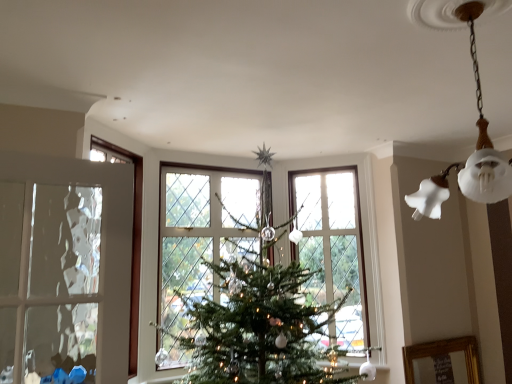
What do you see at coordinates (333, 248) in the screenshot? The height and width of the screenshot is (384, 512). I see `clear glass window at center` at bounding box center [333, 248].

Measure the distance between point (328,285) and camera.

3.58 meters.

The height and width of the screenshot is (384, 512). In order to click on clear glass window at center in this screenshot , I will do `click(333, 248)`.

Describe the element at coordinates (476, 122) in the screenshot. I see `white frosted glass bell at upper right` at that location.

Identify the location of white frosted glass bell at upper right. (476, 122).

Find the location of a particular element. The width and height of the screenshot is (512, 384). clear glass window at center is located at coordinates (333, 248).

Is white frosted glass bell at upper right at the left side of clear glass window at center?

Incorrect, white frosted glass bell at upper right is not on the left side of clear glass window at center.

Is white frosted glass bell at upper right further to camera compared to clear glass window at center?

No.

Is point (449, 15) positioned before point (364, 308)?

Yes, point (449, 15) is closer to viewer.

From the image's perspective, between white frosted glass bell at upper right and clear glass window at center, who is located below?

clear glass window at center.

From a real-world perspective, is white frosted glass bell at upper right physically above clear glass window at center?

Yes, from a real-world perspective, white frosted glass bell at upper right is above clear glass window at center.

Is white frosted glass bell at upper right wider than clear glass window at center?

Yes.

Does white frosted glass bell at upper right have a lesser height compared to clear glass window at center?

Indeed, white frosted glass bell at upper right has a lesser height compared to clear glass window at center.

Considering the sizes of white frosted glass bell at upper right and clear glass window at center in the image, is white frosted glass bell at upper right bigger or smaller than clear glass window at center?

white frosted glass bell at upper right is bigger than clear glass window at center.

Choose the correct answer: Is white frosted glass bell at upper right inside clear glass window at center or outside it?

white frosted glass bell at upper right is not inside clear glass window at center, it's outside.

Is white frosted glass bell at upper right directly adjacent to clear glass window at center?

No, white frosted glass bell at upper right is not with clear glass window at center.

Is white frosted glass bell at upper right looking in the opposite direction of clear glass window at center?

No, white frosted glass bell at upper right's orientation is not away from clear glass window at center.

At what (x,y) coordinates should I click in order to perform the action: click on window lying below the white frosted glass bell at upper right (from the image's perspective). Please return your answer as a coordinate pair (x, y). This screenshot has height=384, width=512. Looking at the image, I should click on (333, 248).

Considering the positions of objects clear glass window at center and white frosted glass bell at upper right in the image provided, who is more to the left, clear glass window at center or white frosted glass bell at upper right?

clear glass window at center is more to the left.

Consider the image. Is clear glass window at center in front of or behind white frosted glass bell at upper right in the image?

Visually, clear glass window at center is located behind white frosted glass bell at upper right.

Is point (311, 258) farther from viewer compared to point (496, 191)?

Yes, point (311, 258) is farther from viewer.

From the image's perspective, which is above, clear glass window at center or white frosted glass bell at upper right?

white frosted glass bell at upper right is shown above in the image.

From a real-world perspective, is clear glass window at center under white frosted glass bell at upper right?

Yes, from a real-world perspective, clear glass window at center is beneath white frosted glass bell at upper right.

Considering the sizes of clear glass window at center and white frosted glass bell at upper right in the image, is clear glass window at center wider or thinner than white frosted glass bell at upper right?

Clearly, clear glass window at center has less width compared to white frosted glass bell at upper right.

Which of these two, clear glass window at center or white frosted glass bell at upper right, stands taller?

clear glass window at center.

Based on their sizes in the image, would you say clear glass window at center is bigger or smaller than white frosted glass bell at upper right?

Clearly, clear glass window at center is smaller in size than white frosted glass bell at upper right.

From the picture: Can we say clear glass window at center lies outside white frosted glass bell at upper right?

That's correct, clear glass window at center is outside of white frosted glass bell at upper right.

Would you say clear glass window at center is a long distance from white frosted glass bell at upper right?

clear glass window at center is far away from white frosted glass bell at upper right.

Is clear glass window at center facing towards white frosted glass bell at upper right?

No, clear glass window at center is not oriented towards white frosted glass bell at upper right.

How many degrees apart are the facing directions of clear glass window at center and white frosted glass bell at upper right?

41.5 degrees separate the facing orientations of clear glass window at center and white frosted glass bell at upper right.

Consider the image. Measure the distance from clear glass window at center to white frosted glass bell at upper right.

The distance of clear glass window at center from white frosted glass bell at upper right is 6.68 feet.

You are a GUI agent. You are given a task and a screenshot of the screen. Output one action in this format:
    pyautogui.click(x=<x>, y=<y>)
    Task: Click on the window that is under the white frosted glass bell at upper right (from a real-world perspective)
    The width and height of the screenshot is (512, 384).
    Given the screenshot: What is the action you would take?
    pyautogui.click(x=333, y=248)

You are a GUI agent. You are given a task and a screenshot of the screen. Output one action in this format:
    pyautogui.click(x=<x>, y=<y>)
    Task: Click on the lamp on the right of clear glass window at center
    This screenshot has height=384, width=512.
    Given the screenshot: What is the action you would take?
    pyautogui.click(x=476, y=122)

The height and width of the screenshot is (384, 512). I want to click on window on the left side of white frosted glass bell at upper right, so click(333, 248).